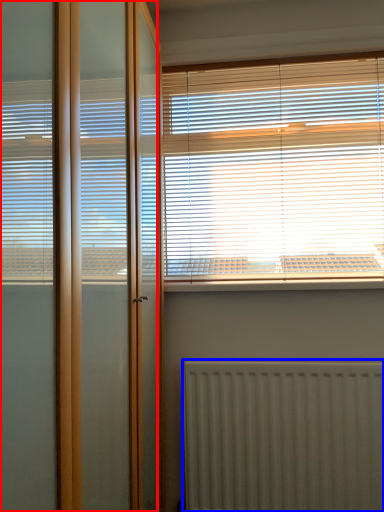
Question: Which object is closer to the camera taking this photo, screen door (highlighted by a red box) or radiator (highlighted by a blue box)?

Choices:
 (A) screen door
 (B) radiator

Answer: (A)